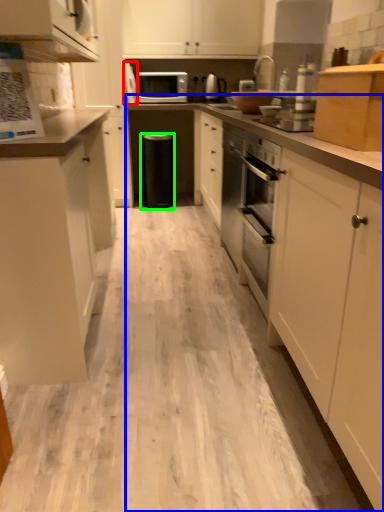
Question: Estimate the real-world distances between objects in this image. Which object is farther from appliance (highlighted by a red box), countertop (highlighted by a blue box) or dish washer (highlighted by a green box)?

Choices:
 (A) countertop
 (B) dish washer

Answer: (A)